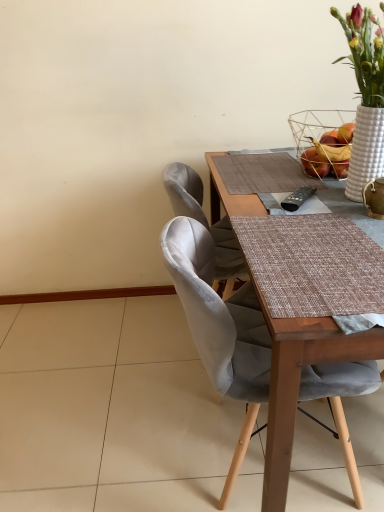
At what (x,y) coordinates should I click in order to perform the action: click on free space in front of white textured basket at upper right. Please return your answer as a coordinate pair (x, y). Looking at the image, I should click on (325, 195).